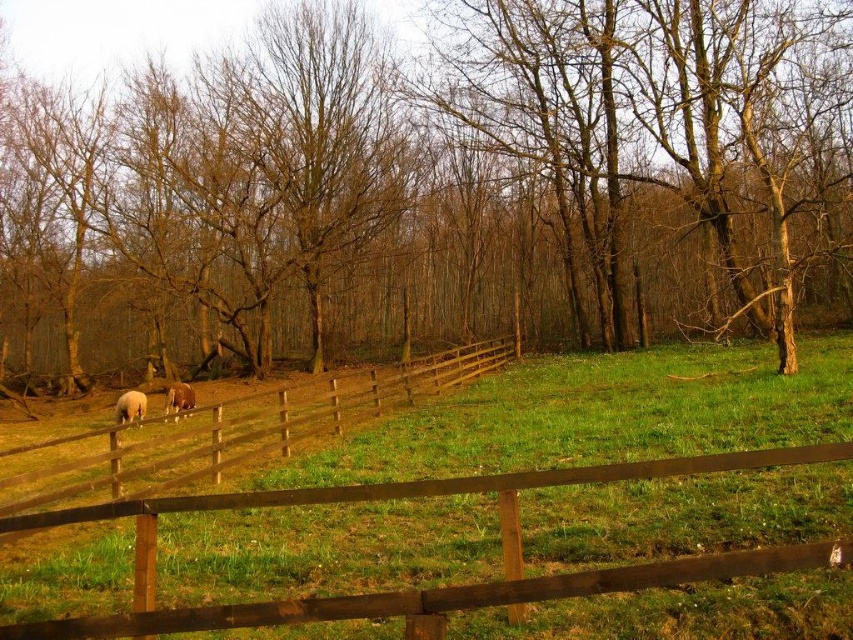
Question: Which of the following is the farthest from the observer?

Choices:
 (A) (183, 388)
 (B) (341, 188)
 (C) (142, 404)

Answer: (B)

Question: From the image, what is the correct spatial relationship of brown wood fence at lower center in relation to brown wooden fence at left?

Choices:
 (A) right
 (B) left

Answer: (A)

Question: Which object is positioned closest to the white woolly sheep at lower left?

Choices:
 (A) white woolly sheep at center
 (B) brown wooden fence at left
 (C) brown wood fence at lower center

Answer: (A)

Question: Is brown wooden fence at left wider than white woolly sheep at lower left?

Choices:
 (A) yes
 (B) no

Answer: (A)

Question: Does brown wood fence at lower center come in front of white woolly sheep at lower left?

Choices:
 (A) yes
 (B) no

Answer: (A)

Question: Which is farther from the white woolly sheep at lower left?

Choices:
 (A) brown wooden fence at left
 (B) white woolly sheep at center
 (C) brown wood fence at lower center

Answer: (C)